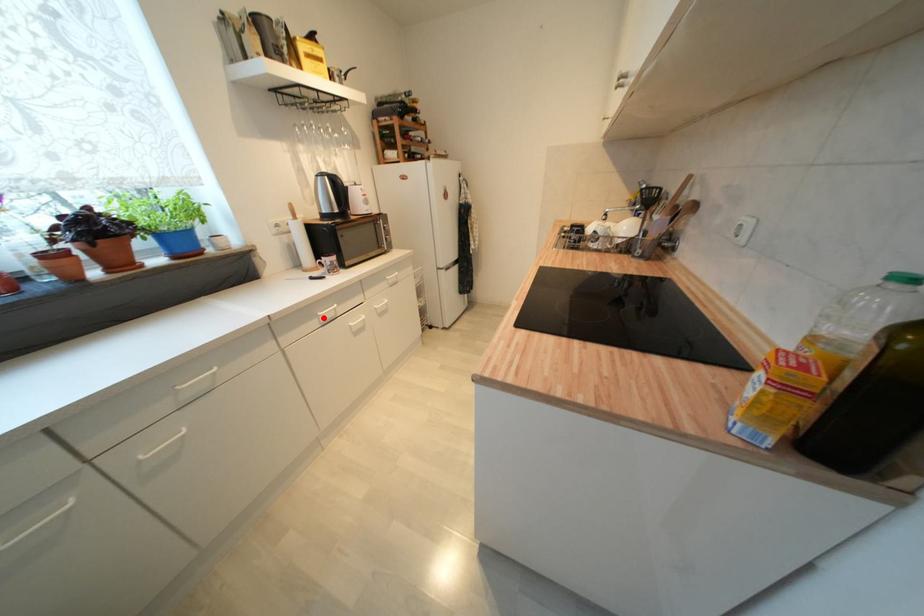
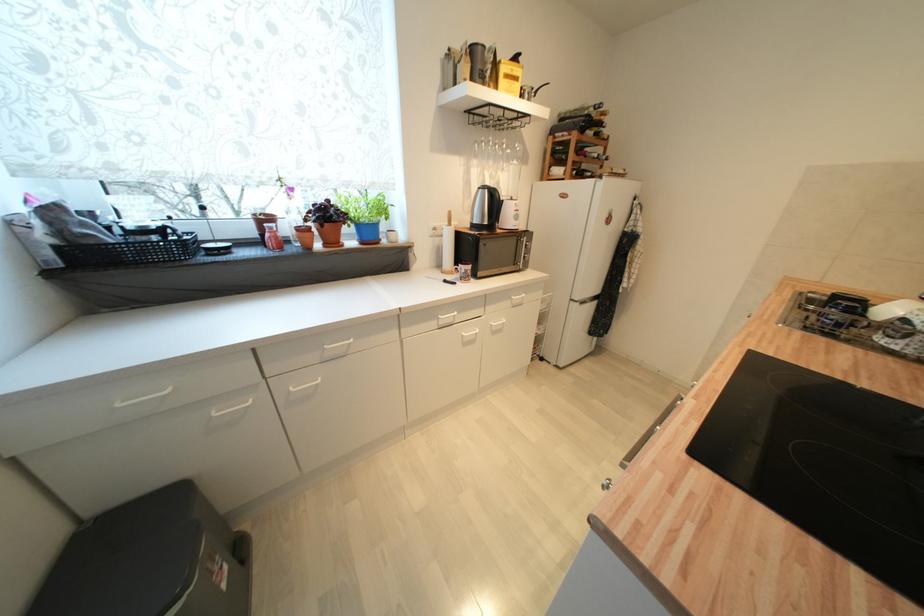
Where in the second image is the point corresponding to the highlighted location from the first image?

(444, 321)